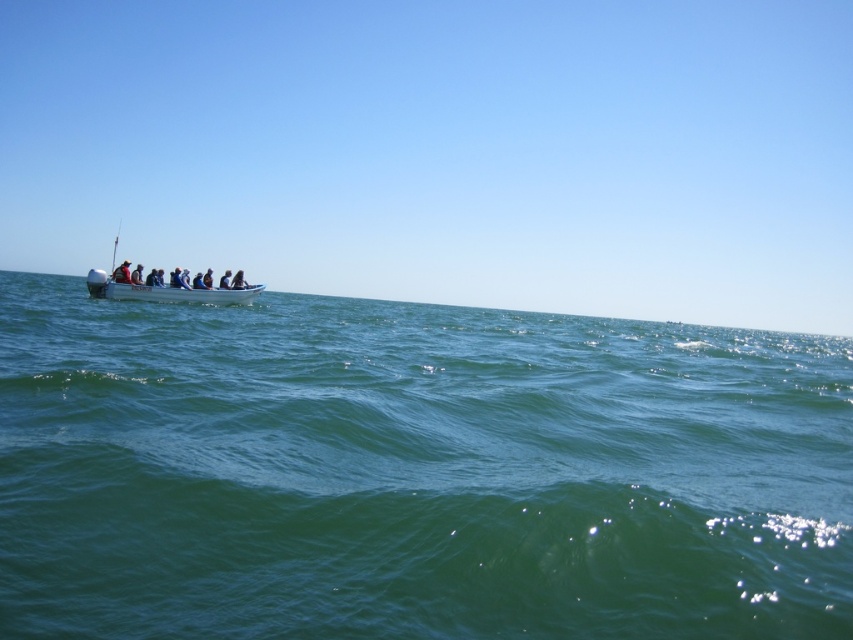
You are standing on the shore and see both the white plastic boat at left and the dark blue fabric boat at center. Which boat would appear larger to you?

The white plastic boat at left appears larger because it is closer to the viewer than the dark blue fabric boat at center.

You are standing on the shore looking at the green water at left and the white plastic boat at left. Which object appears taller from your viewpoint?

The green water at left appears taller than the white plastic boat at left from your viewpoint.

You are planning to take a boat trip and see both the white plastic boat at left and the dark blue fabric boat at center in the image. Which boat would you choose if you want to accommodate more passengers?

The white plastic boat at left has a larger size compared to the dark blue fabric boat at center, so it can accommodate more passengers.